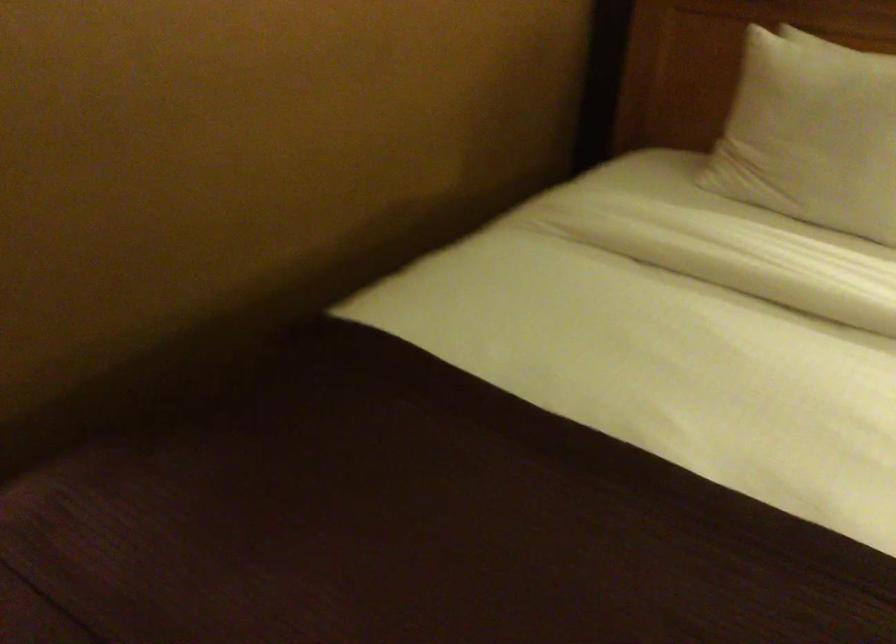
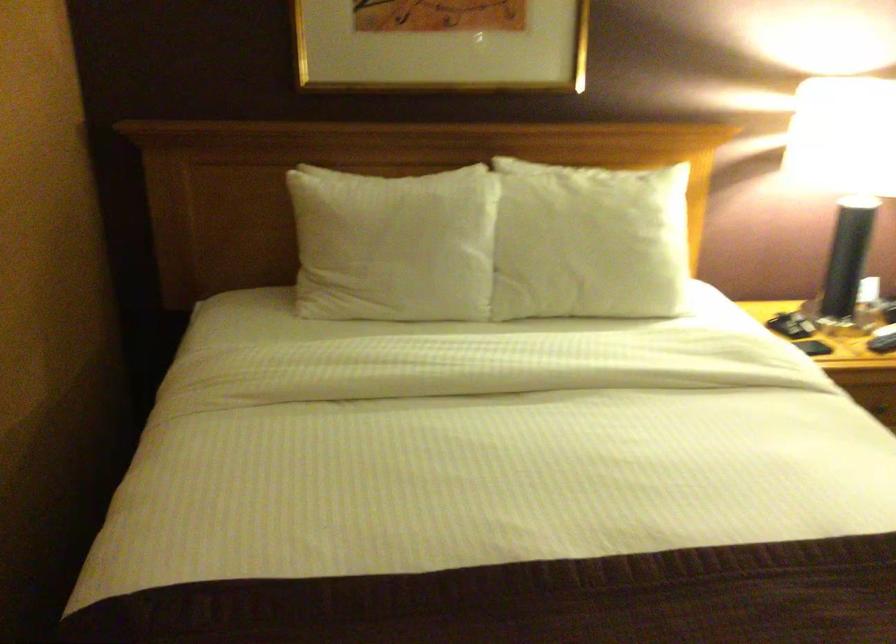
Locate, in the second image, the point that corresponds to (825,129) in the first image.

(393, 245)